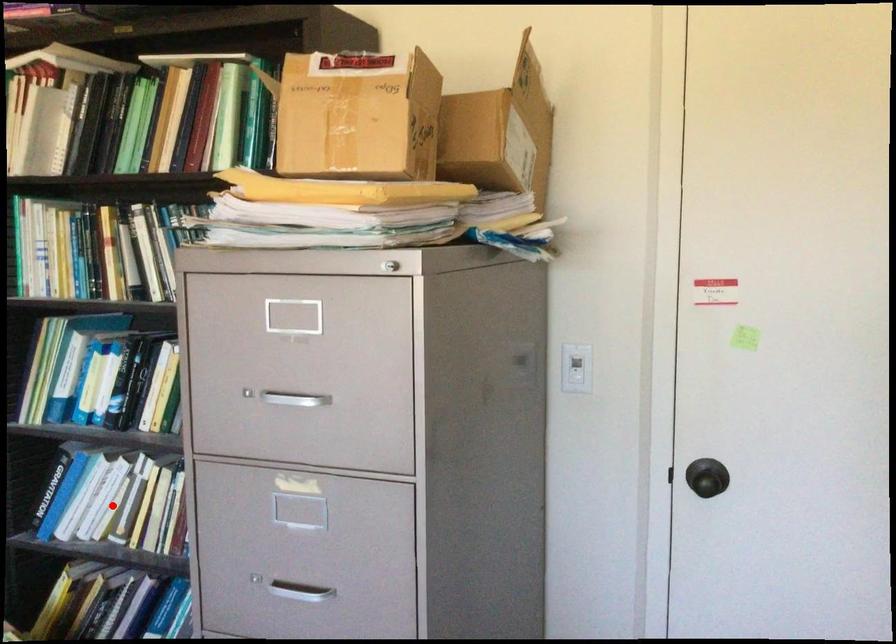
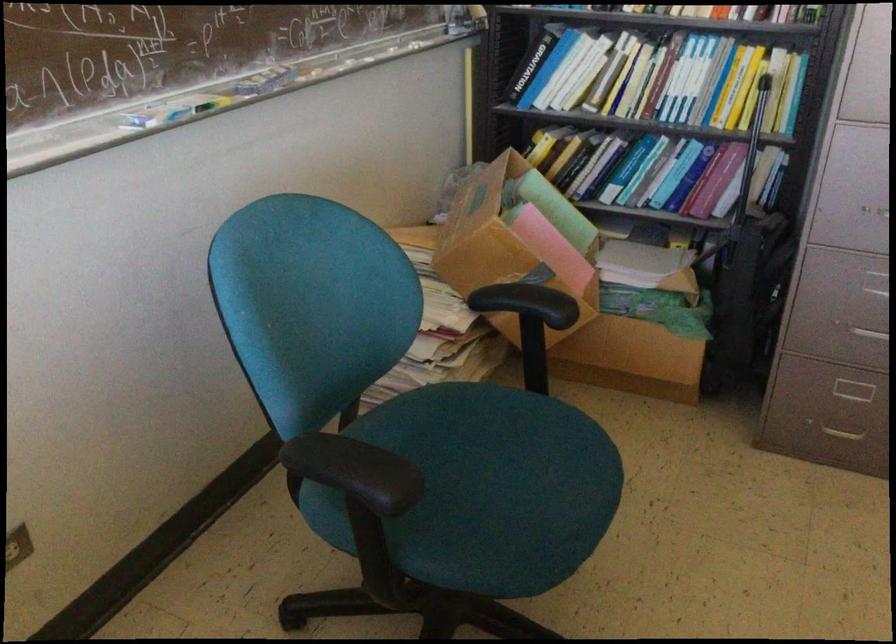
Question: I am providing you with two images of the same scene from different viewpoints. A red point is shown in image1. For the corresponding object point in image2, is it positioned nearer or farther from the camera?

Choices:
 (A) Nearer
 (B) Farther

Answer: (B)